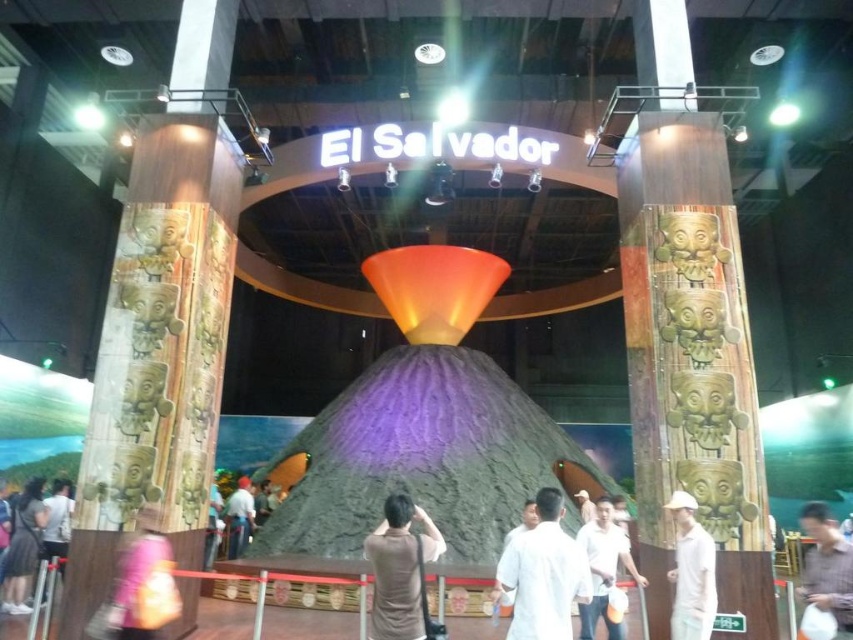
Question: Which of the following is the farthest from the observer?

Choices:
 (A) brown matte shirt at center
 (B) pink fabric bag at lower left
 (C) white matte shirt at center
 (D) brown shirt at center

Answer: (D)

Question: Which is nearer to the white matte shirt at center?

Choices:
 (A) pink fabric bag at lower left
 (B) white shirt at center
 (C) matte gray shirt at lower left

Answer: (A)

Question: Considering the relative positions of white cotton shirt at center and white matte shirt at center in the image provided, where is white cotton shirt at center located with respect to white matte shirt at center?

Choices:
 (A) below
 (B) above

Answer: (B)

Question: Does white cotton shirt at center appear under matte gray shirt at lower left?

Choices:
 (A) yes
 (B) no

Answer: (B)

Question: Which point appears farthest from the camera in this image?

Choices:
 (A) (556, 637)
 (B) (601, 497)
 (C) (689, 628)
 (D) (819, 515)

Answer: (B)

Question: Is white matte shirt at center closer to the viewer compared to white matte shirt at lower left?

Choices:
 (A) yes
 (B) no

Answer: (A)